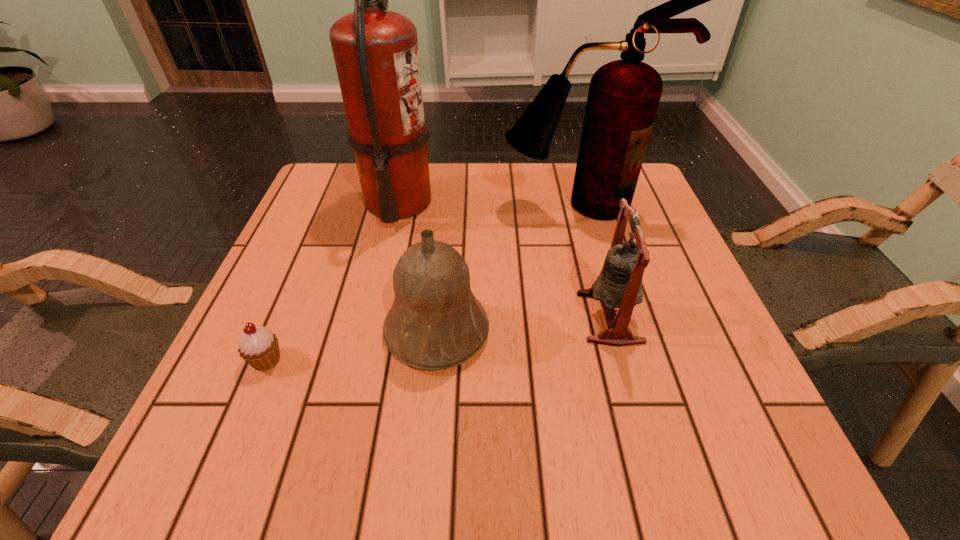
The width and height of the screenshot is (960, 540). What are the coordinates of `the left fire extinguisher` in the screenshot? It's located at (376, 54).

Identify the location of the right fire extinguisher. (623, 97).

The image size is (960, 540). What are the coordinates of `the right bell` in the screenshot? It's located at (619, 285).

Identify the location of the left bell. (435, 322).

Locate an element on the screen. cupcake is located at coordinates (258, 346).

Identify the location of the leftmost object. The image size is (960, 540). (258, 346).

The image size is (960, 540). I want to click on free space located toward the nozzle of the left fire extinguisher, so click(535, 202).

Locate an element on the screen. free spot located 0.320m at the nozzle of the right fire extinguisher is located at coordinates (612, 328).

This screenshot has height=540, width=960. What are the coordinates of `vacant space positioned 0.290m on the back of the right bell` in the screenshot? It's located at (578, 204).

What are the coordinates of `vacant area situated 0.330m on the right of the left bell` in the screenshot? It's located at (671, 331).